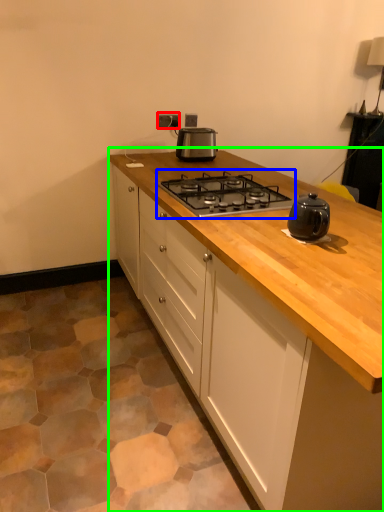
Question: Which object is positioned closest to electric outlet (highlighted by a red box)? Select from gas stove (highlighted by a blue box) and cabinetry (highlighted by a green box).

Choices:
 (A) gas stove
 (B) cabinetry

Answer: (A)